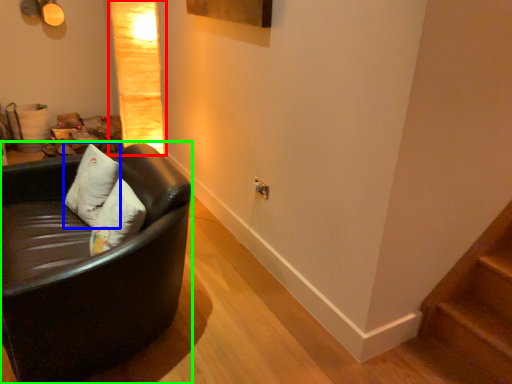
Question: Based on their relative distances, which object is farther from lamp (highlighted by a red box)? Choose from pillow (highlighted by a blue box) and studio couch (highlighted by a green box).

Choices:
 (A) pillow
 (B) studio couch

Answer: (B)